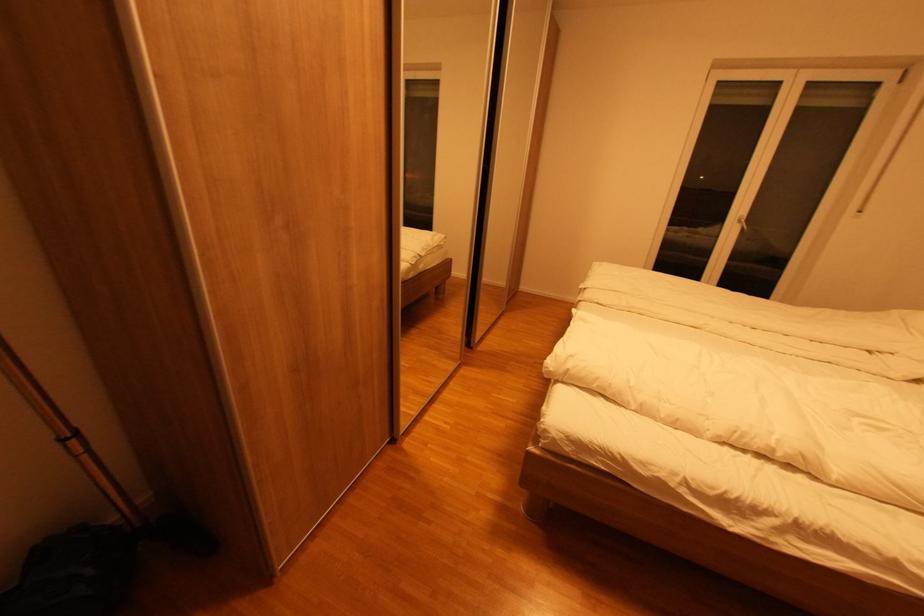
The image size is (924, 616). What do you see at coordinates (743, 224) in the screenshot?
I see `a white window handle` at bounding box center [743, 224].